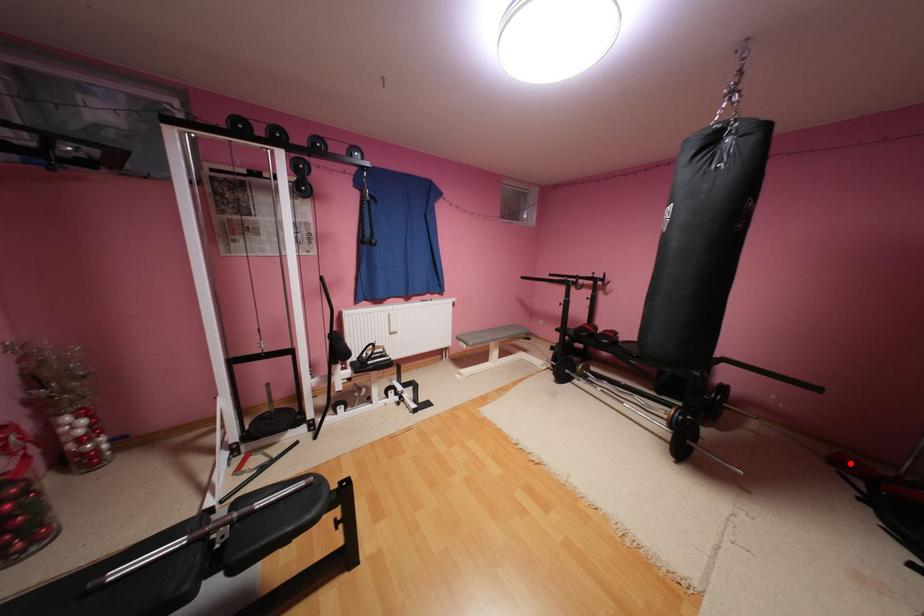
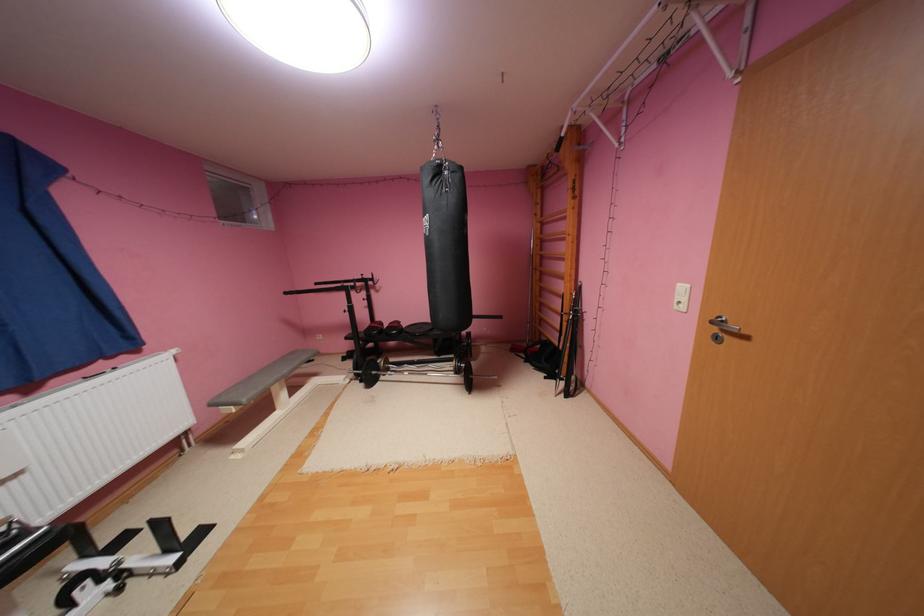
Question: I am providing you with two images of the same scene from different viewpoints. A red point is shown in image1. For the corresponding object point in image2, is it positioned nearer or farther from the camera?

Choices:
 (A) Nearer
 (B) Farther

Answer: (A)